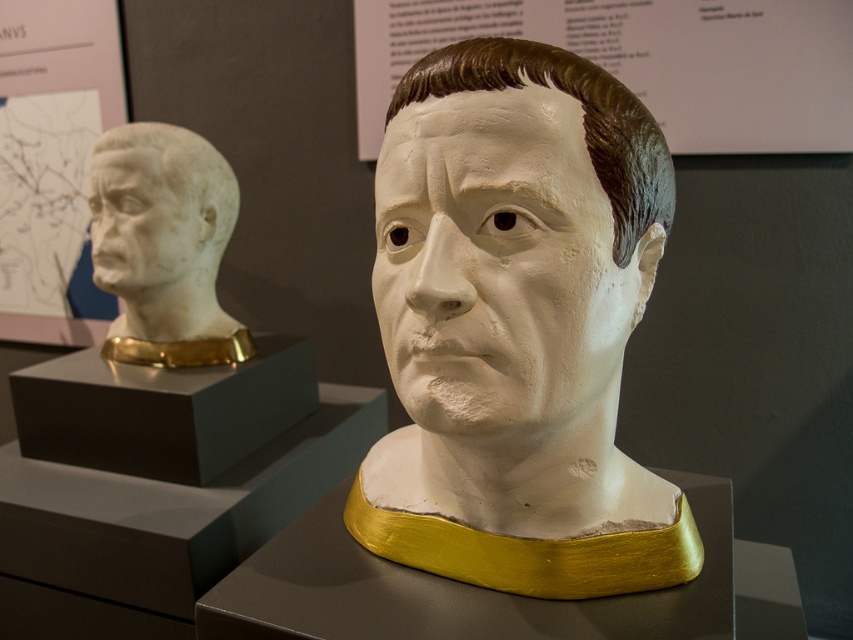
Does white matte bust at center appear under white matte plaster head at center?

Yes, white matte bust at center is below white matte plaster head at center.

Between white matte bust at center and white matte plaster head at center, which one appears on the left side from the viewer's perspective?

From the viewer's perspective, white matte bust at center appears more on the left side.

Locate an element on the screen. The width and height of the screenshot is (853, 640). white matte bust at center is located at coordinates (517, 326).

You are a GUI agent. You are given a task and a screenshot of the screen. Output one action in this format:
    pyautogui.click(x=<x>, y=<y>)
    Task: Click on the white matte bust at center
    Image resolution: width=853 pixels, height=640 pixels.
    Given the screenshot: What is the action you would take?
    pyautogui.click(x=517, y=326)

Does white marble bust at left have a larger size compared to white plaster face at upper left?

Indeed, white marble bust at left has a larger size compared to white plaster face at upper left.

Is point (160, 189) farther from camera compared to point (100, 161)?

No, it is not.

Is point (236, 188) farther from viewer compared to point (131, 260)?

Yes.

Find the location of a particular element. Image resolution: width=853 pixels, height=640 pixels. white marble bust at left is located at coordinates (163, 244).

From the picture: Does white matte plaster head at center have a greater height compared to white marble bust at left?

In fact, white matte plaster head at center may be shorter than white marble bust at left.

Can you confirm if white matte plaster head at center is wider than white marble bust at left?

No, white matte plaster head at center is not wider than white marble bust at left.

Describe the element at coordinates (498, 268) in the screenshot. I see `white matte plaster head at center` at that location.

This screenshot has height=640, width=853. I want to click on white matte plaster head at center, so 498,268.